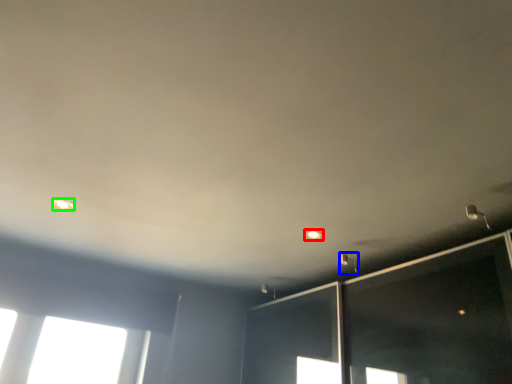
Question: Which object is the farthest from dot (highlighted by a red box)? Choose among these: light fixture (highlighted by a blue box) or dot (highlighted by a green box).

Choices:
 (A) light fixture
 (B) dot

Answer: (B)